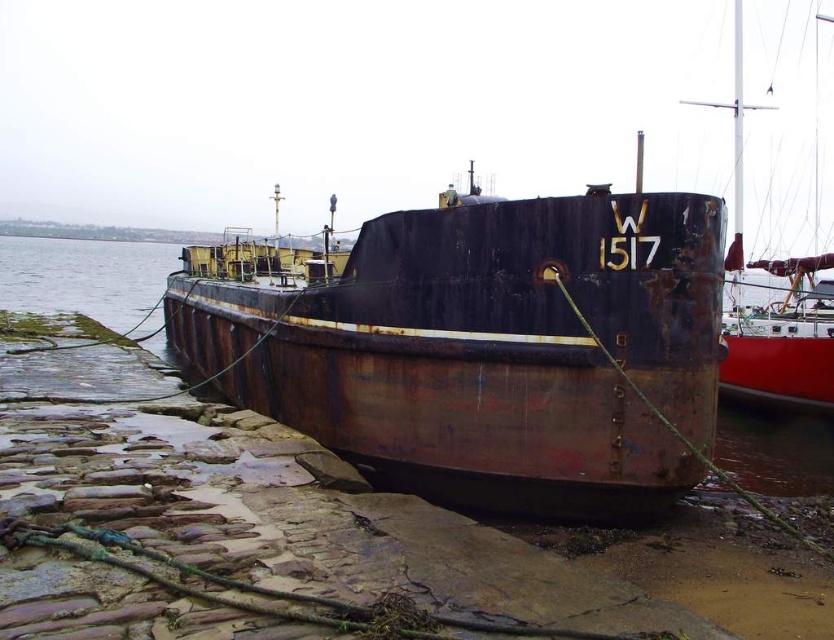
This screenshot has width=834, height=640. What do you see at coordinates (488, 349) in the screenshot?
I see `rusty metal boat at center` at bounding box center [488, 349].

Is rusty metal boat at center further to camera compared to rusty metal boat at right?

No.

I want to click on rusty metal boat at center, so click(488, 349).

This screenshot has width=834, height=640. Identify the location of rusty metal boat at center. (488, 349).